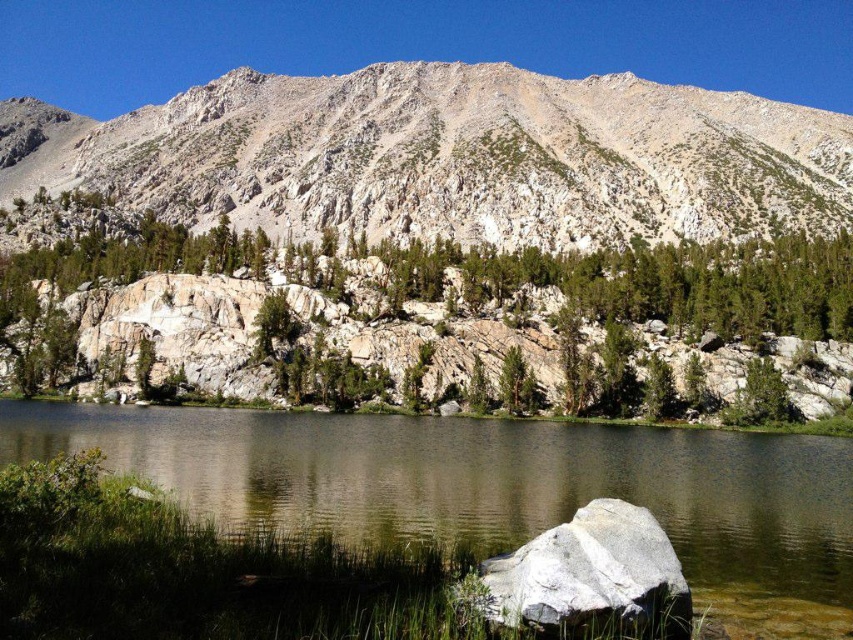
Question: Is clear water at center smaller than white granite boulder at lower center?

Choices:
 (A) yes
 (B) no

Answer: (B)

Question: Which point appears farthest from the camera in this image?

Choices:
 (A) pos(805,112)
 (B) pos(511,618)

Answer: (A)

Question: In this image, where is clear water at center located relative to white granite boulder at lower center?

Choices:
 (A) left
 (B) right

Answer: (A)

Question: Which object is positioned farthest from the clear water at center?

Choices:
 (A) white granite boulder at lower center
 (B) green textured rock at upper center

Answer: (B)

Question: Is clear water at center smaller than green textured rock at upper center?

Choices:
 (A) yes
 (B) no

Answer: (A)

Question: Which object appears closest to the camera in this image?

Choices:
 (A) rugged stone mountain at upper center
 (B) green textured rock at upper center

Answer: (B)